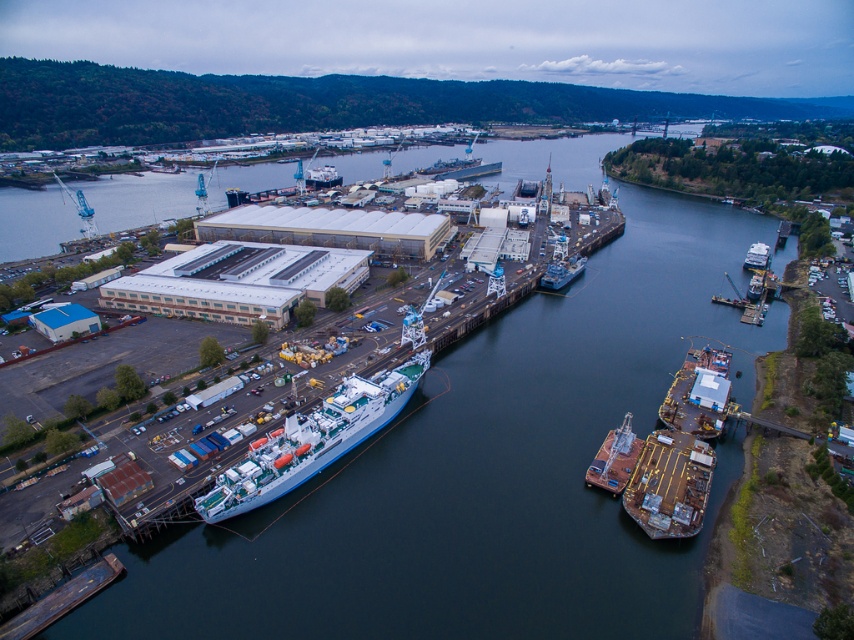
You are a harbor inspector tasked with ensuring all boats adhere to size regulations. The maximum allowed width for boats in this harbor is 15 meters. You observe the rusty metal boat at center and the white glossy boat at upper right. Based on their widths, which boat is more likely to exceed the size limit?

The rusty metal boat at center is more likely to exceed the size limit because its width is larger than that of the white glossy boat at upper right.

You are a drone operator trying to capture a photo of the point at coordinates point (629, 440) in the harbor scene. The drone has a maximum flight range of 120 meters. Can the drone reach the point to take the photo?

The point (629, 440) is 117.83 meters away from the camera, so yes, the drone can reach the point to take the photo since its maximum flight range of 120 meters exceeds the required distance.